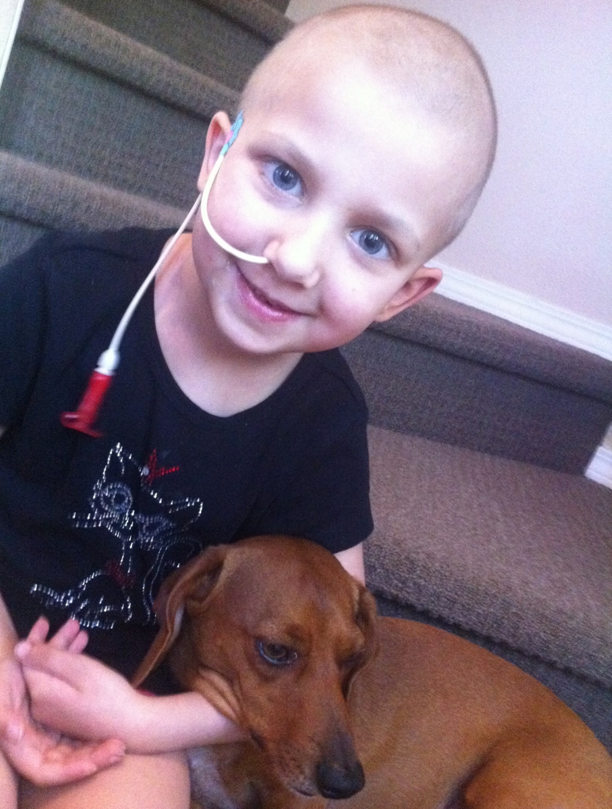
Locate an element on the screen. The image size is (612, 809). carpet is located at coordinates (559, 620).